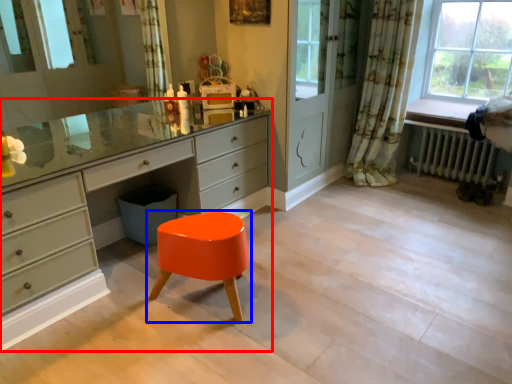
Question: Which object appears closest to the camera in this image, chest of drawers (highlighted by a red box) or stool (highlighted by a blue box)?

Choices:
 (A) chest of drawers
 (B) stool

Answer: (A)